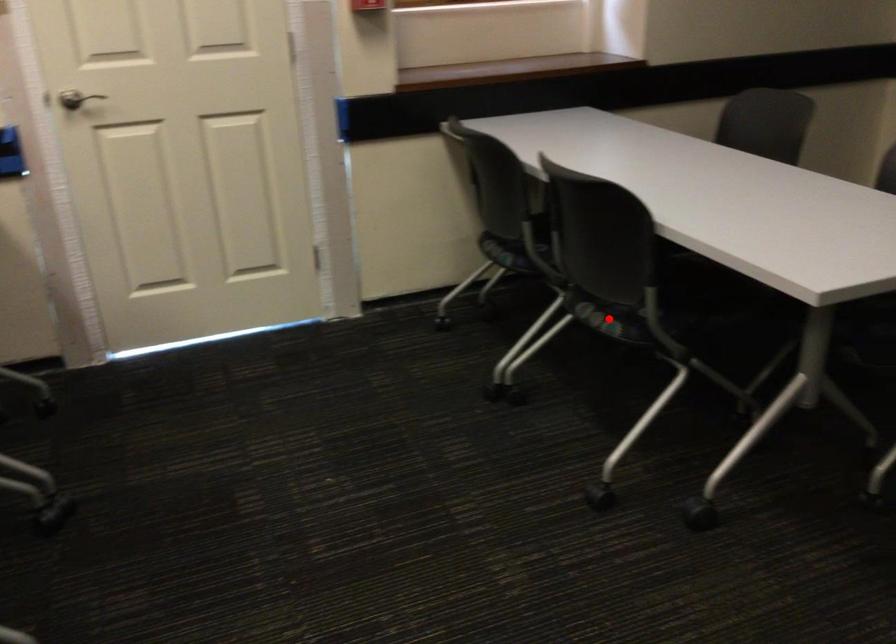
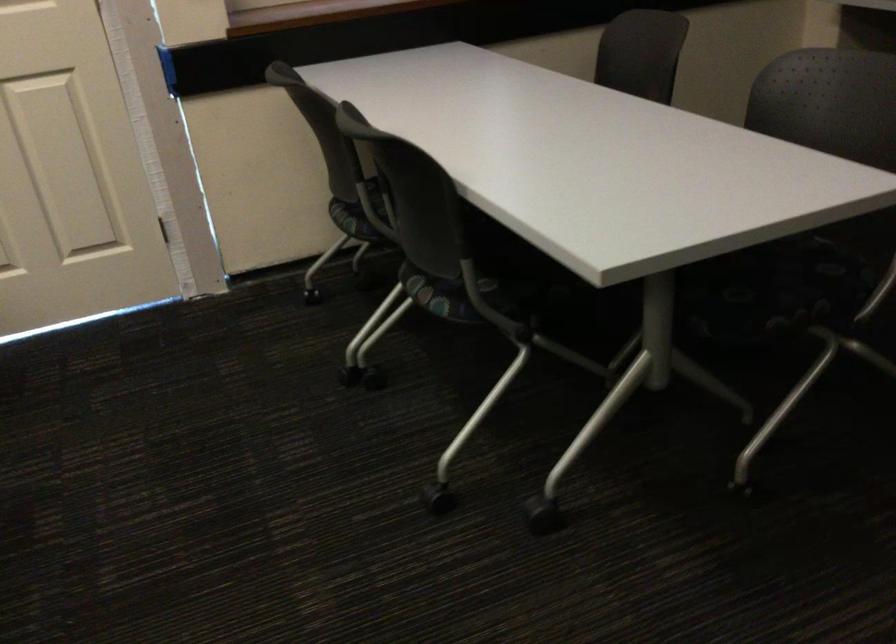
Question: I am providing you with two images of the same scene from different viewpoints. Image1 has a red point marked. In image2, the corresponding 3D location appears at what relative position? Reply with the corresponding letter.

Choices:
 (A) Closer
 (B) Farther

Answer: (A)